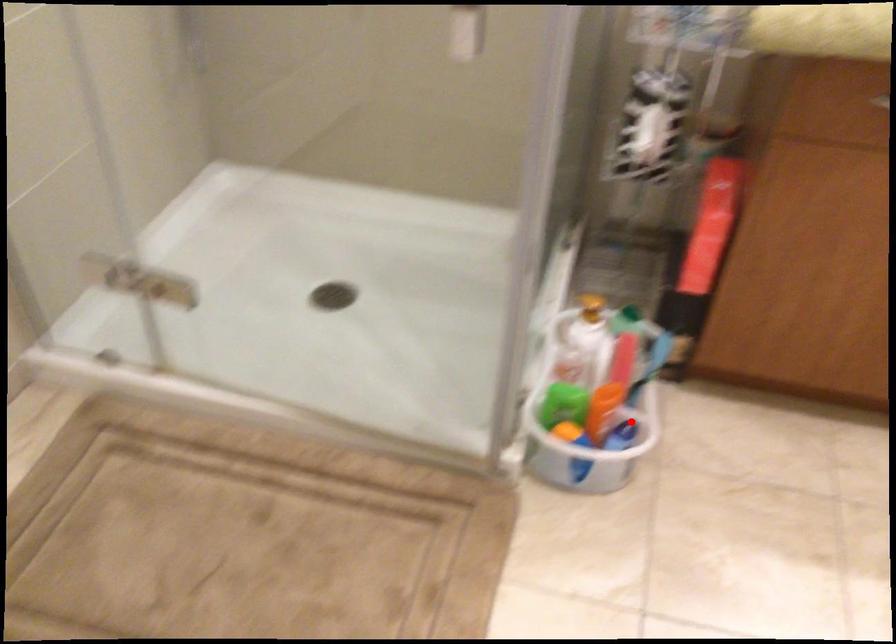
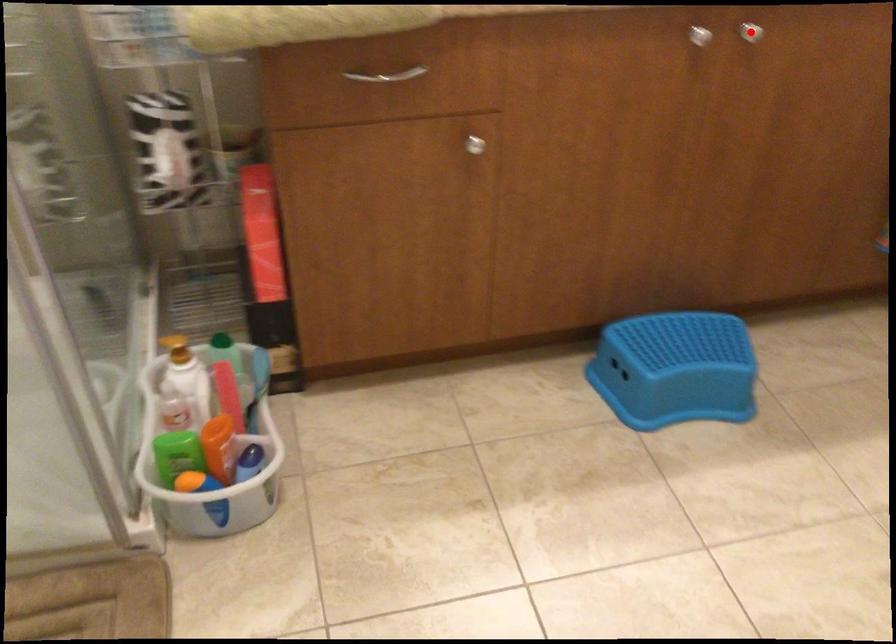
I am providing you with two images of the same scene from different viewpoints. A red point is marked on the first image and another point is marked on the second image. Is the marked point in image1 the same physical position as the marked point in image2?

No